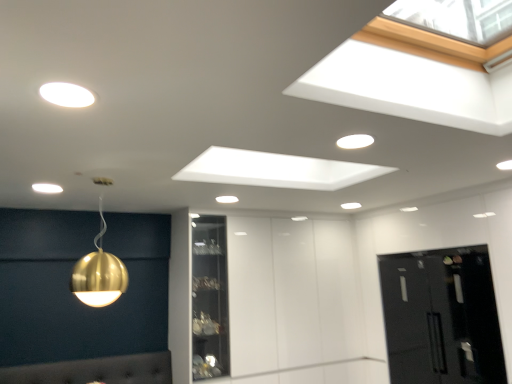
Question: Does point (486, 319) appear closer or farther from the camera than point (101, 288)?

Choices:
 (A) closer
 (B) farther

Answer: (B)

Question: From a real-world perspective, relative to gold metallic sphere at upper left, the 5th lamp in the top-to-bottom sequence, is black glass door at lower right vertically above or below?

Choices:
 (A) above
 (B) below

Answer: (B)

Question: Estimate the real-world distances between objects in this image. Which object is farther from the matte white light fixture at upper left, which is the 5th lamp from back to front?

Choices:
 (A) black glass door at lower right
 (B) matte gold sphere at upper left, the 3th lamp when ordered from back to front
 (C) gold metallic sphere at upper left, the first lamp when ordered from bottom to top
 (D) matte gold sphere at upper center, which is the 2th lamp in back-to-front order
 (E) matte gold sphere at upper center, arranged as the second lamp when ordered from the bottom

Answer: (A)

Question: Which object is positioned closest to the black glass door at lower right?

Choices:
 (A) matte gold sphere at upper center, which is the second lamp from right to left
 (B) gold metallic sphere at upper left, acting as the 2th lamp starting from the front
 (C) matte white light fixture at upper left, which is the 1th lamp from front to back
 (D) matte gold sphere at upper left, which is counted as the fourth lamp, starting from the bottom
 (E) matte gold sphere at upper center, the 4th lamp in the top-to-bottom sequence

Answer: (E)